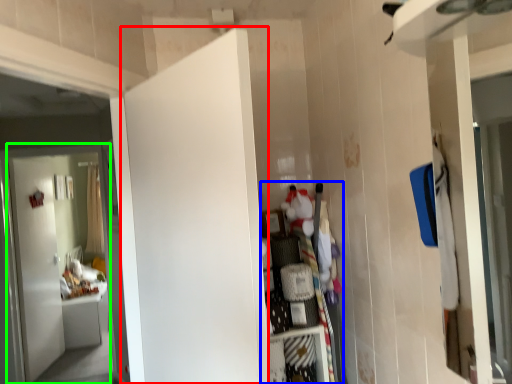
Question: Considering the real-world distances, which object is closest to door (highlighted by a red box)? dresser (highlighted by a blue box) or door (highlighted by a green box).

Choices:
 (A) dresser
 (B) door

Answer: (A)